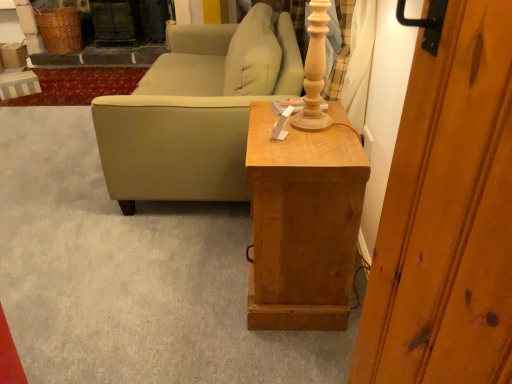
The image size is (512, 384). What are the coordinates of `vacant space positioned to the left of wooden side table at center` in the screenshot? It's located at (188, 271).